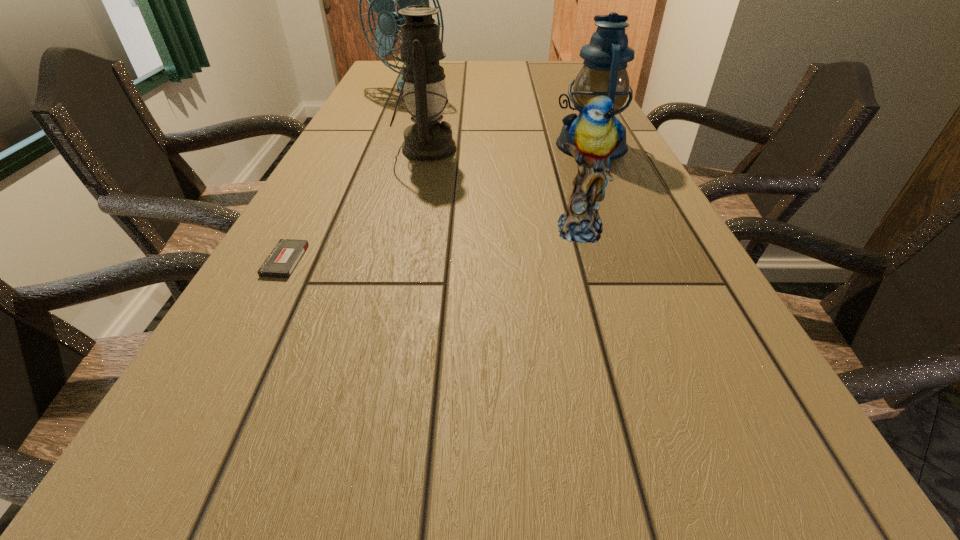
At what (x,y) coordinates should I click in order to perform the action: click on vacant space that's between the farthest object and the shortest object. Please return your answer as a coordinate pair (x, y). The image size is (960, 540). Looking at the image, I should click on (347, 174).

At what (x,y) coordinates should I click in order to perform the action: click on vacant point located between the oil lamp and the lantern. Please return your answer as a coordinate pair (x, y). The height and width of the screenshot is (540, 960). Looking at the image, I should click on (509, 147).

This screenshot has height=540, width=960. What are the coordinates of `vacant space in between the lantern and the oil lamp` in the screenshot? It's located at (509, 147).

Locate an element on the screen. vacant area that lies between the oil lamp and the videotape is located at coordinates (355, 205).

Identify the location of vacant space that's between the parrot and the oil lamp. Image resolution: width=960 pixels, height=540 pixels. (503, 189).

Find the location of a particular element. The height and width of the screenshot is (540, 960). vacant area between the fan and the videotape is located at coordinates (347, 174).

Find the location of a particular element. This screenshot has width=960, height=540. empty location between the shortest object and the oil lamp is located at coordinates (355, 205).

Locate an element on the screen. object that is the fourth closest to the lantern is located at coordinates (281, 262).

Locate which object is the second closest to the lantern. Please provide its 2D coordinates. Your answer should be formatted as a tuple, i.e. [(x, y)], where the tuple contains the x and y coordinates of a point satisfying the conditions above.

[(425, 98)]

Where is `free location that satisfies the following two spatial constraints: 1. on the face of the lantern; 2. on the front side of the oil lamp`? Image resolution: width=960 pixels, height=540 pixels. free location that satisfies the following two spatial constraints: 1. on the face of the lantern; 2. on the front side of the oil lamp is located at coordinates (593, 149).